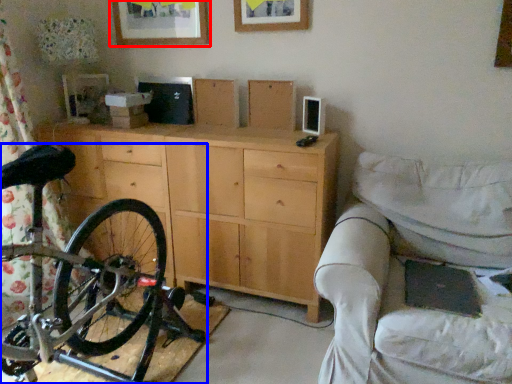
Question: Which object appears closest to the camera in this image, picture frame (highlighted by a red box) or bicycle (highlighted by a blue box)?

Choices:
 (A) picture frame
 (B) bicycle

Answer: (B)